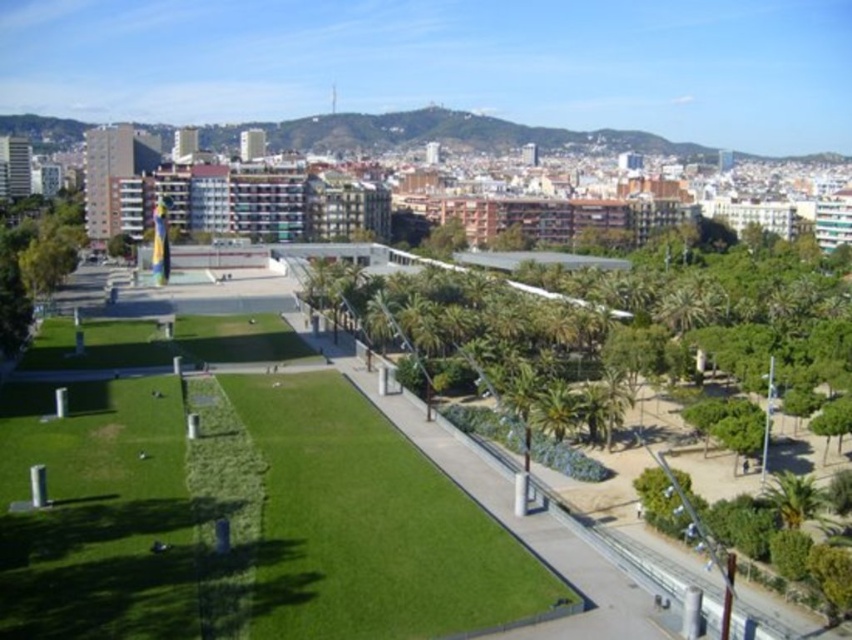
You are standing on the paved pathway and want to walk to the green grass at center. Which direction should you go relative to the green leafy tree at center?

You should go to the left side of the green leafy tree at center because the green grass at center is positioned on the left side of it.

You are planning to plant a new tree in this urban space. The new tree will be the same size as the green leafy tree at center. Where should you plant it so that it doesn not block the view of the larger green leafy tree at left?

You should plant the new tree in a position where it does not obstruct the view of the larger green leafy tree at left. Since the green leafy tree at center is smaller than the green leafy tree at left, placing the new tree behind or to the side of the larger tree would ensure it doesn not block the view.

You are a gardener planning to water the green grass at center and the green leafy tree at left. Based on their positions, which one should you water first if you start from the pathway?

The green grass at center should be watered first because it is located below the green leafy tree at left, meaning it is closer to the pathway where you are standing.